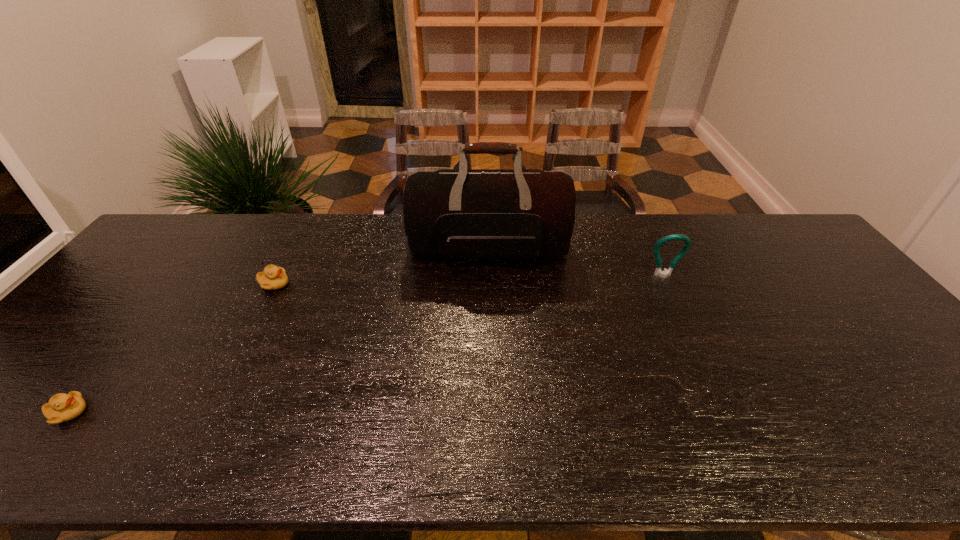
This screenshot has width=960, height=540. Find the location of `the second object from right to left`. the second object from right to left is located at coordinates (487, 214).

At what (x,y) coordinates should I click in order to perform the action: click on the tallest object. Please return your answer as a coordinate pair (x, y). This screenshot has height=540, width=960. Looking at the image, I should click on click(487, 214).

At what (x,y) coordinates should I click in order to perform the action: click on the rightmost object. Please return your answer as a coordinate pair (x, y). The height and width of the screenshot is (540, 960). Looking at the image, I should click on (687, 243).

Where is `the third shortest object`? the third shortest object is located at coordinates (687, 243).

Find the location of a particular element. the second object from left to right is located at coordinates (274, 277).

Locate an element on the screen. Image resolution: width=960 pixels, height=540 pixels. the farther duckling is located at coordinates (274, 277).

Locate an element on the screen. the leftmost object is located at coordinates (62, 407).

Find the location of `the nearest object`. the nearest object is located at coordinates (62, 407).

Where is `vacant space located on the front pocket of the duffel bag`? This screenshot has height=540, width=960. vacant space located on the front pocket of the duffel bag is located at coordinates (492, 379).

Locate an element on the screen. The width and height of the screenshot is (960, 540). free space located 0.390m at the jaws of the rightmost object is located at coordinates (718, 390).